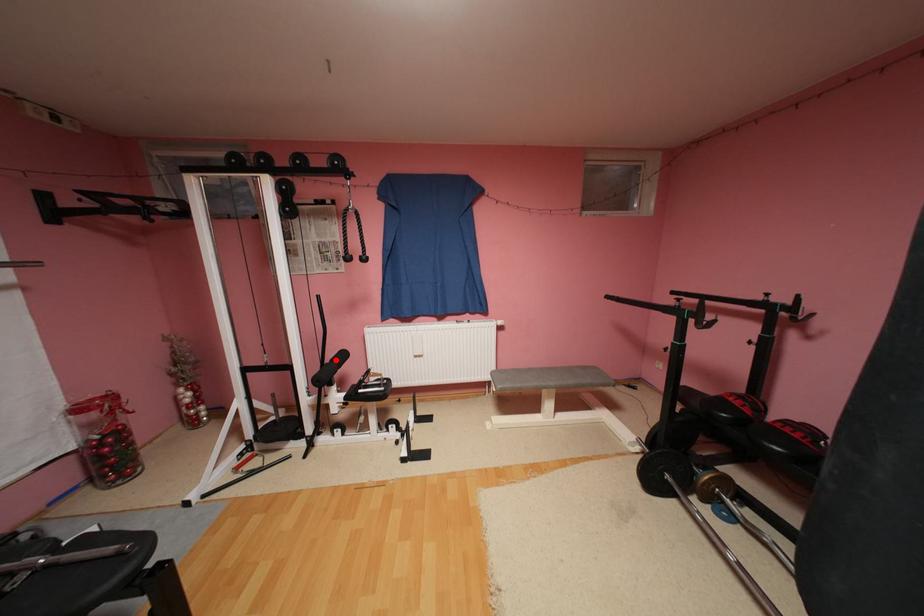
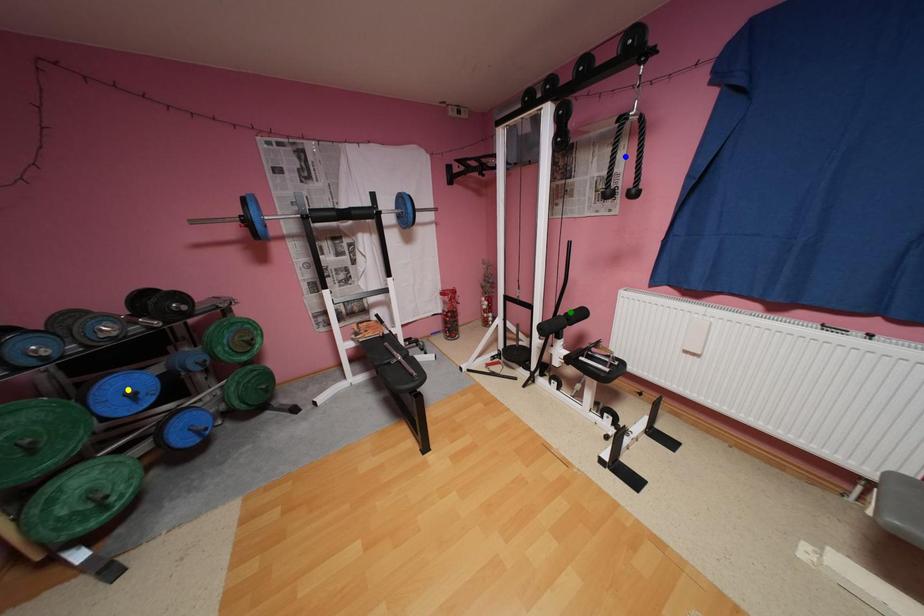
Question: I am providing you with two images of the same scene from different viewpoints. A red point is marked on the first image. You are given multiple points on the second image. Which point in image 2 is actually the same real-world point as the red point in image 1?

Choices:
 (A) green point
 (B) yellow point
 (C) blue point

Answer: (A)